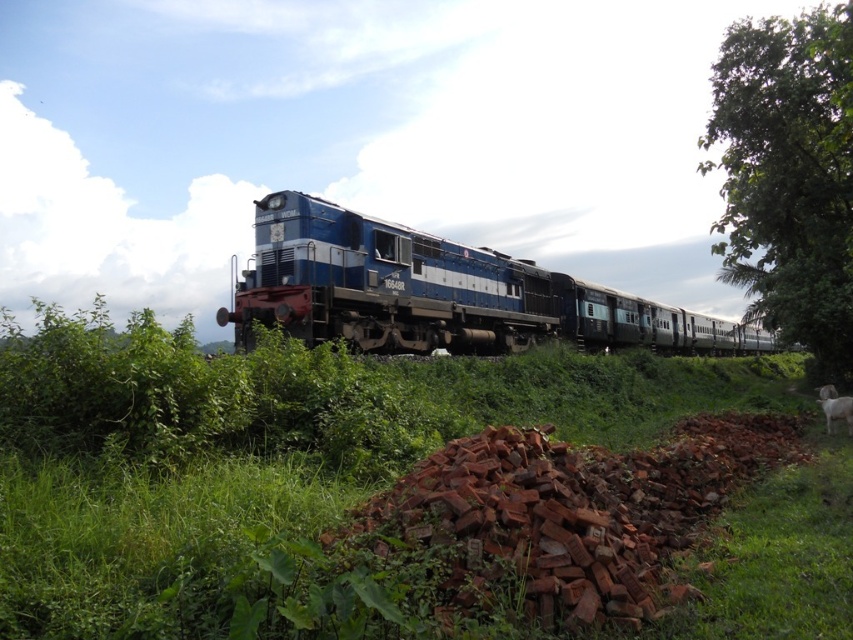
Can you confirm if blue metallic train at center is taller than green leafy tree at right?

No, blue metallic train at center is not taller than green leafy tree at right.

Does blue metallic train at center appear on the left side of green leafy tree at right?

Indeed, blue metallic train at center is positioned on the left side of green leafy tree at right.

Who is more forward, (263,228) or (772,132)?

Point (263,228) is more forward.

Identify the location of blue metallic train at center. click(439, 292).

Who is more forward, (817, 307) or (840, 416)?

Positioned in front is point (840, 416).

Can you confirm if green leafy tree at right is thinner than white woolen sheep at lower right?

No, green leafy tree at right is not thinner than white woolen sheep at lower right.

Who is more forward, (x=799, y=248) or (x=845, y=401)?

Positioned in front is point (x=845, y=401).

Image resolution: width=853 pixels, height=640 pixels. What are the coordinates of `green leafy tree at right` in the screenshot? It's located at (788, 173).

Is blue metallic train at center in front of white woolen sheep at lower right?

No, it is not.

Based on the photo, who is more distant from viewer, (318, 317) or (833, 417)?

Positioned behind is point (318, 317).

At what (x,y) coordinates should I click in order to perform the action: click on blue metallic train at center. Please return your answer as a coordinate pair (x, y). The width and height of the screenshot is (853, 640). Looking at the image, I should click on (439, 292).